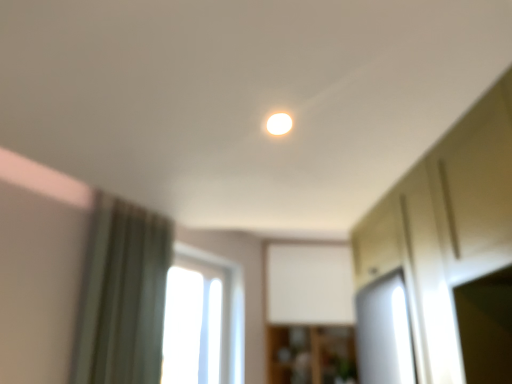
Question: Considering the relative sizes of transparent glass window at center and green fabric curtain at left in the image provided, is transparent glass window at center bigger than green fabric curtain at left?

Choices:
 (A) no
 (B) yes

Answer: (A)

Question: Considering the relative sizes of transparent glass window at center and green fabric curtain at left in the image provided, is transparent glass window at center taller than green fabric curtain at left?

Choices:
 (A) yes
 (B) no

Answer: (B)

Question: From the image's perspective, is transparent glass window at center on green fabric curtain at left?

Choices:
 (A) no
 (B) yes

Answer: (A)

Question: Is transparent glass window at center far from green fabric curtain at left?

Choices:
 (A) no
 (B) yes

Answer: (B)

Question: Is transparent glass window at center not within green fabric curtain at left?

Choices:
 (A) yes
 (B) no

Answer: (A)

Question: Does transparent glass window at center appear on the right side of green fabric curtain at left?

Choices:
 (A) yes
 (B) no

Answer: (A)

Question: Is green fabric curtain at left at the right side of matte white light at center?

Choices:
 (A) no
 (B) yes

Answer: (A)

Question: Does green fabric curtain at left have a lesser width compared to matte white light at center?

Choices:
 (A) yes
 (B) no

Answer: (B)

Question: Is green fabric curtain at left shorter than matte white light at center?

Choices:
 (A) yes
 (B) no

Answer: (B)

Question: Does green fabric curtain at left have a smaller size compared to matte white light at center?

Choices:
 (A) no
 (B) yes

Answer: (A)

Question: Is green fabric curtain at left facing towards matte white light at center?

Choices:
 (A) yes
 (B) no

Answer: (A)

Question: Considering the relative positions of green fabric curtain at left and matte white light at center in the image provided, is green fabric curtain at left to the left of matte white light at center from the viewer's perspective?

Choices:
 (A) no
 (B) yes

Answer: (B)

Question: From a real-world perspective, is wooden cabinet at center positioned over transparent glass window at center based on gravity?

Choices:
 (A) yes
 (B) no

Answer: (B)